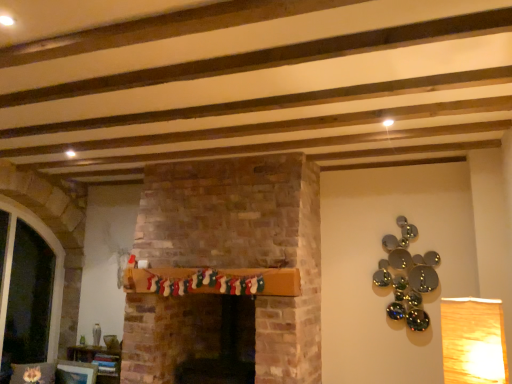
Question: Can you confirm if wooden bookshelf at lower left is positioned to the right of transparent glass door at left?

Choices:
 (A) yes
 (B) no

Answer: (A)

Question: From the image's perspective, would you say wooden bookshelf at lower left is positioned over transparent glass door at left?

Choices:
 (A) no
 (B) yes

Answer: (A)

Question: Does wooden bookshelf at lower left have a lesser width compared to transparent glass door at left?

Choices:
 (A) yes
 (B) no

Answer: (A)

Question: Considering the relative sizes of wooden bookshelf at lower left and transparent glass door at left in the image provided, is wooden bookshelf at lower left smaller than transparent glass door at left?

Choices:
 (A) yes
 (B) no

Answer: (A)

Question: Are wooden bookshelf at lower left and transparent glass door at left located far from each other?

Choices:
 (A) yes
 (B) no

Answer: (A)

Question: Considering the relative positions of transparent glass door at left and wooden mantel at center in the image provided, is transparent glass door at left to the left or to the right of wooden mantel at center?

Choices:
 (A) right
 (B) left

Answer: (B)

Question: In terms of size, does transparent glass door at left appear bigger or smaller than wooden mantel at center?

Choices:
 (A) big
 (B) small

Answer: (A)

Question: In terms of height, does transparent glass door at left look taller or shorter compared to wooden mantel at center?

Choices:
 (A) short
 (B) tall

Answer: (B)

Question: Would you say transparent glass door at left is inside or outside wooden mantel at center?

Choices:
 (A) inside
 (B) outside

Answer: (B)

Question: Is matte white picture frame at lower left taller or shorter than wooden bookshelf at lower left?

Choices:
 (A) tall
 (B) short

Answer: (B)

Question: Would you say matte white picture frame at lower left is inside or outside wooden bookshelf at lower left?

Choices:
 (A) outside
 (B) inside

Answer: (A)

Question: Does point (80, 372) appear closer or farther from the camera than point (96, 360)?

Choices:
 (A) closer
 (B) farther

Answer: (A)

Question: Is matte white picture frame at lower left to the left or to the right of wooden bookshelf at lower left in the image?

Choices:
 (A) right
 (B) left

Answer: (B)

Question: Considering the positions of point (20, 206) and point (56, 382), is point (20, 206) closer or farther from the camera than point (56, 382)?

Choices:
 (A) closer
 (B) farther

Answer: (A)

Question: Is transparent glass door at left taller or shorter than matte white picture frame at lower left?

Choices:
 (A) tall
 (B) short

Answer: (A)